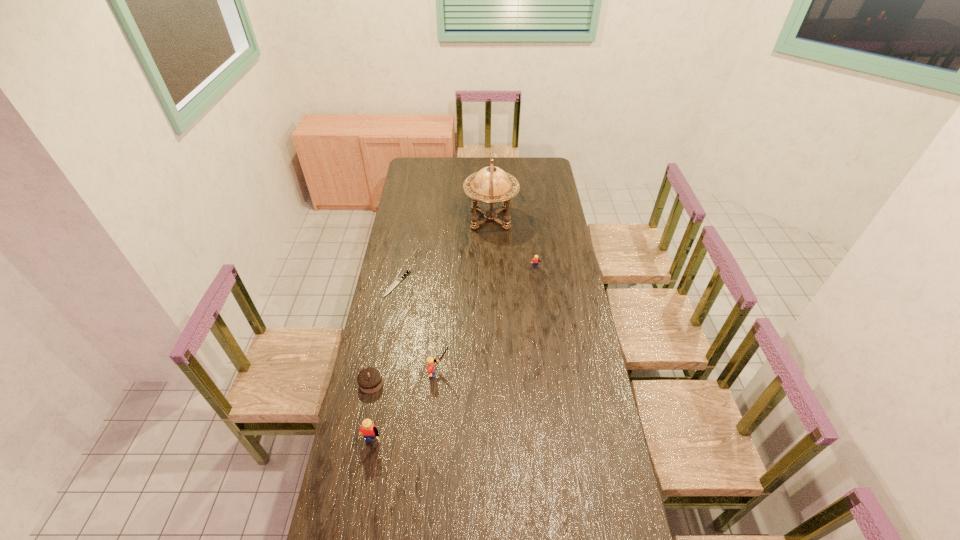
You are a GUI agent. You are given a task and a screenshot of the screen. Output one action in this format:
    pyautogui.click(x=<x>, y=<y>)
    Task: Click on the nearest Lego
    This screenshot has height=540, width=960.
    Given the screenshot: What is the action you would take?
    pyautogui.click(x=368, y=429)

Identify the location of the nearest object. pyautogui.click(x=368, y=429).

This screenshot has width=960, height=540. I want to click on the second shortest Lego, so click(x=430, y=361).

The image size is (960, 540). I want to click on the second Lego from right to left, so click(430, 361).

Identify the location of the rightmost object. The width and height of the screenshot is (960, 540). (535, 262).

The height and width of the screenshot is (540, 960). I want to click on the shortest Lego, so click(x=535, y=262).

I want to click on the farthest object, so click(x=491, y=185).

Locate an element on the screen. globe is located at coordinates (491, 185).

Identify the location of the fifth tallest object. [x=370, y=380].

The image size is (960, 540). Find the location of `steak knife`. steak knife is located at coordinates (398, 280).